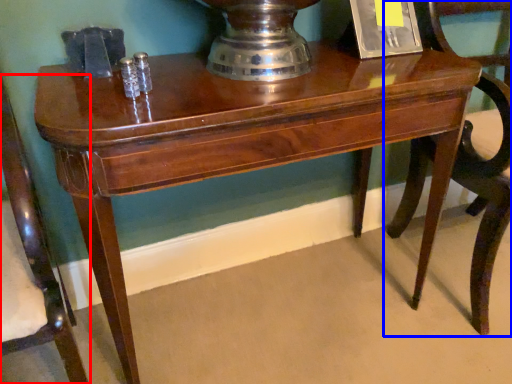
Question: Which object is closer to the camera taking this photo, chair (highlighted by a red box) or chair (highlighted by a blue box)?

Choices:
 (A) chair
 (B) chair

Answer: (A)